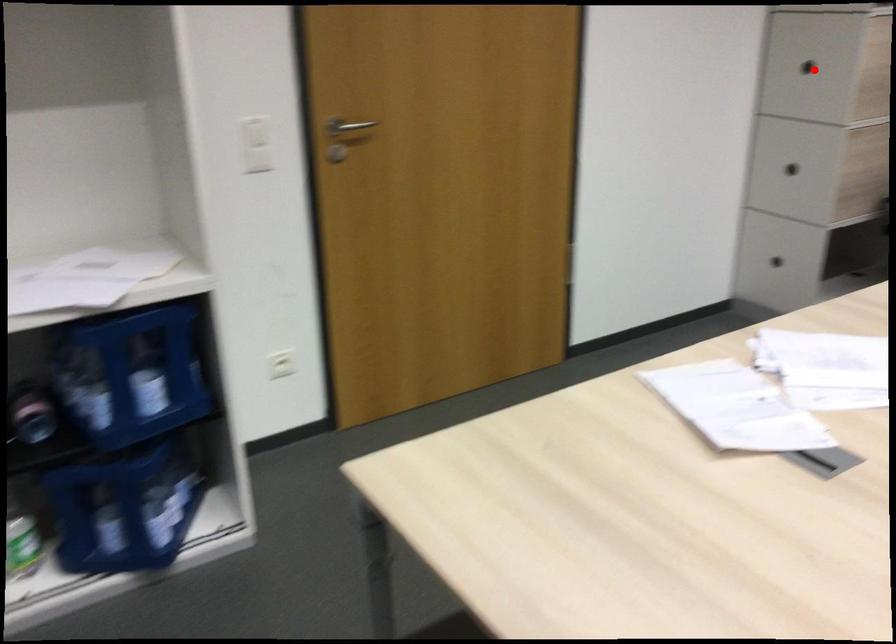
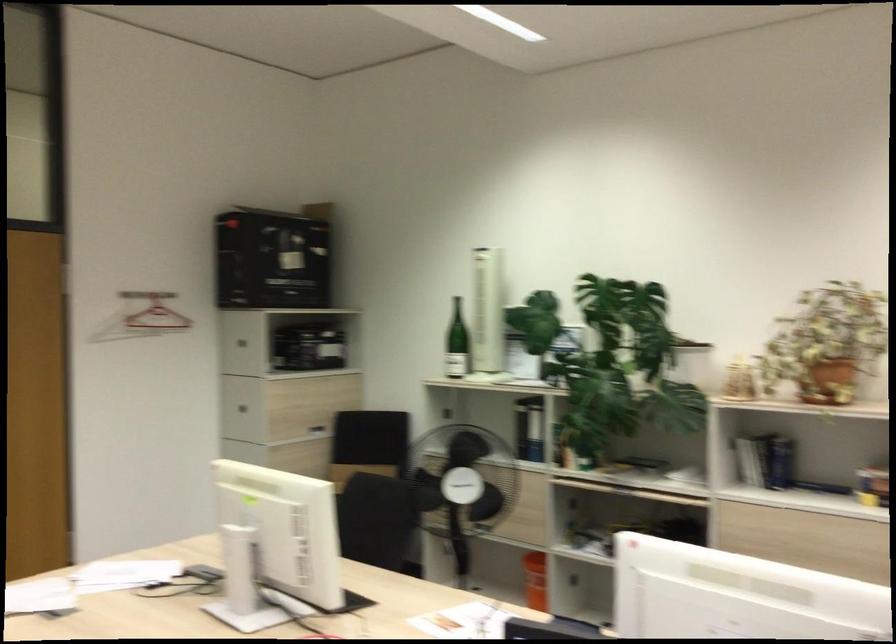
Find the pixel in the second image that matches the highlighted location in the first image.

(244, 402)